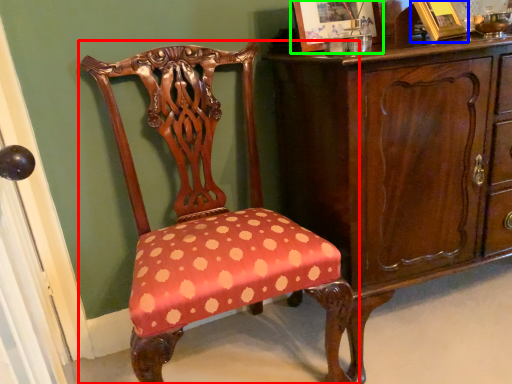
Question: Considering the real-world distances, which object is closest to chair (highlighted by a red box)? picture frame (highlighted by a blue box) or picture frame (highlighted by a green box).

Choices:
 (A) picture frame
 (B) picture frame

Answer: (B)